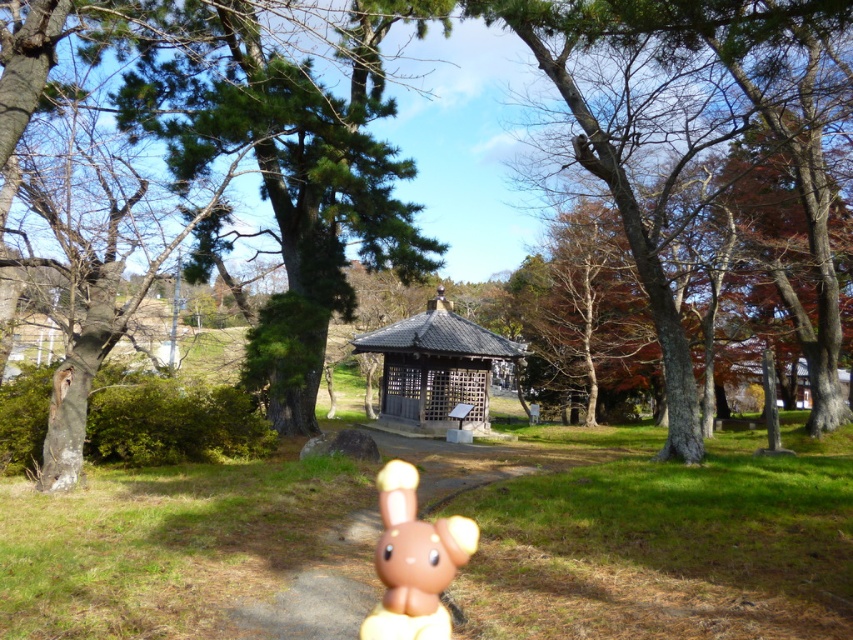
Question: From the image, what is the correct spatial relationship of brown wood tree at center in relation to wooden lattice gazebo at center?

Choices:
 (A) above
 (B) below

Answer: (A)

Question: Does brown wood tree at center have a larger size compared to wooden lattice gazebo at center?

Choices:
 (A) yes
 (B) no

Answer: (A)

Question: Based on their relative distances, which object is farther from the wooden lattice gazebo at center?

Choices:
 (A) brown matte plush toy at center
 (B) brown wood tree at center

Answer: (A)

Question: Which of the following is the closest to the observer?

Choices:
 (A) wooden lattice gazebo at center
 (B) brown wood tree at center
 (C) brown matte plush toy at center

Answer: (C)

Question: Is brown wood tree at center to the left of brown matte plush toy at center from the viewer's perspective?

Choices:
 (A) yes
 (B) no

Answer: (B)

Question: Which of the following is the farthest from the observer?

Choices:
 (A) (763, 104)
 (B) (450, 376)
 (C) (415, 596)

Answer: (B)